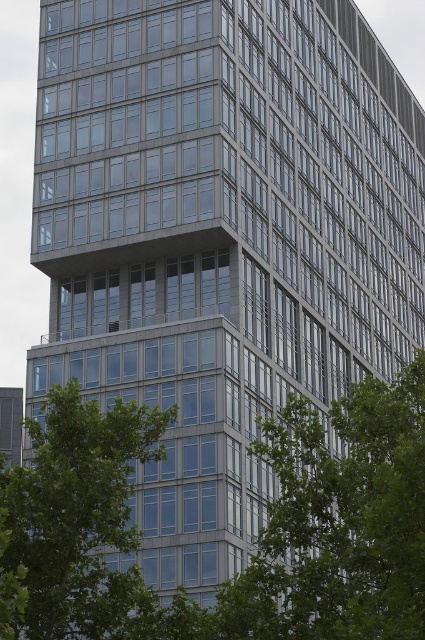
You are a city planner assessing the greenery distribution in the highrise area. You notice two green leafy trees in the scene. Which tree, the green leafy tree at center or the green leafy tree at lower left, has a larger width?

The green leafy tree at center might be wider than green leafy tree at lower left.

You are standing at the base of the modern high rise building and looking up. There is a point marked at coordinates point (340, 522). What object is located at this point?

The point (340, 522) corresponds to a green leafy tree at center.

You are a city planner assessing the greenery distribution in the high rise building area. You see the green leafy tree at center and the green leafy tree at lower left. Which tree would cast a bigger shadow during midday when the sun is directly overhead?

The green leafy tree at center has a larger size compared to the green leafy tree at lower left, so it would cast a bigger shadow during midday when the sun is directly overhead.